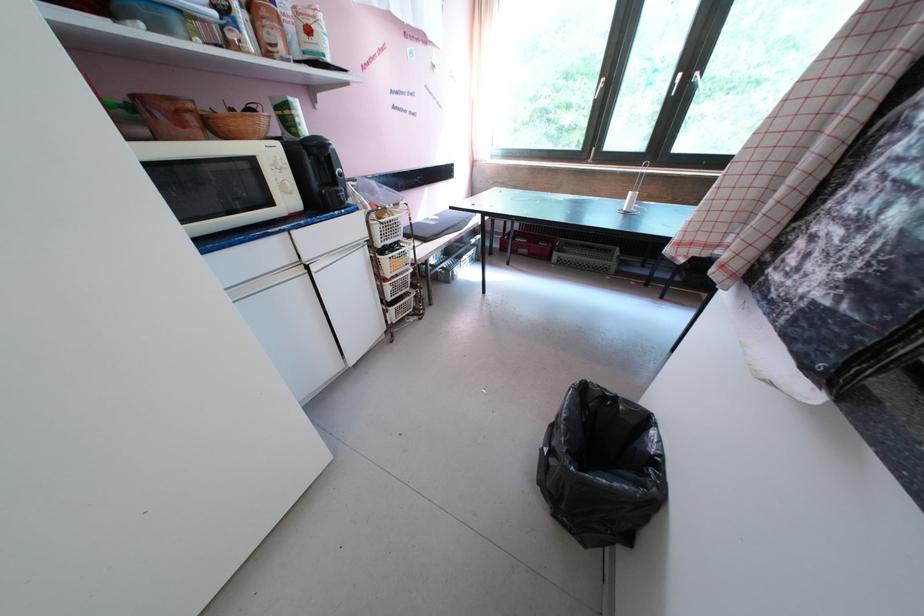
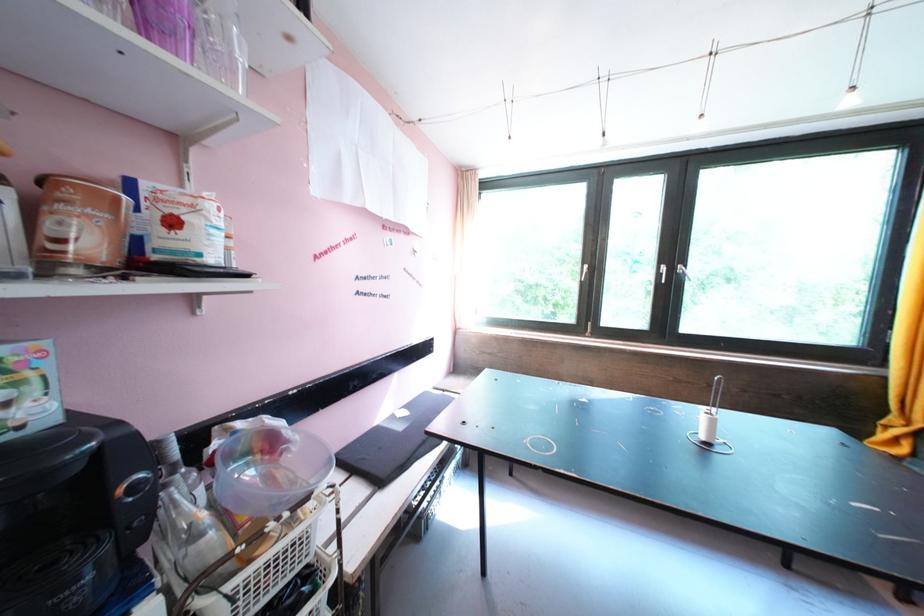
Locate, in the second image, the point that corresponds to the point at 317,33 in the first image.

(181, 225)